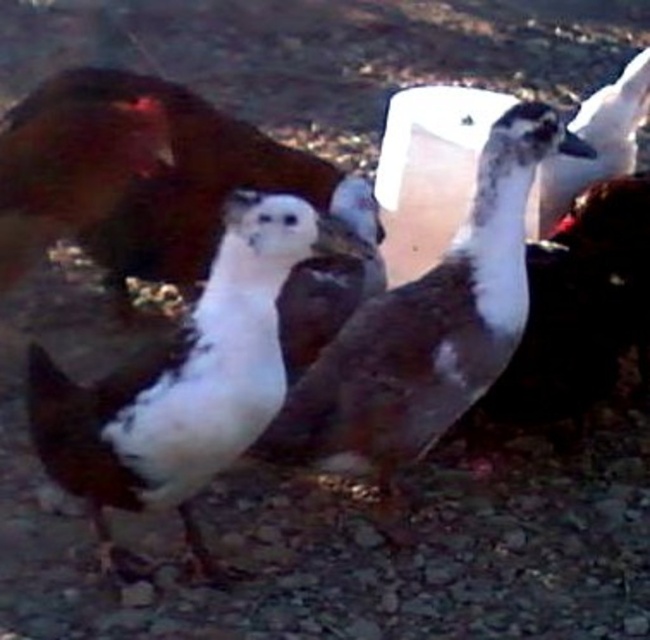
Question: Which point appears closest to the camera in this image?

Choices:
 (A) (83, 432)
 (B) (387, 353)

Answer: (A)

Question: Does white matte duck at center appear under brown matte duck at center?

Choices:
 (A) yes
 (B) no

Answer: (A)

Question: Can you confirm if white matte duck at center is positioned to the left of brown matte duck at center?

Choices:
 (A) no
 (B) yes

Answer: (B)

Question: Among these objects, which one is nearest to the camera?

Choices:
 (A) brown matte duck at center
 (B) white matte duck at center

Answer: (B)

Question: Considering the relative positions of white matte duck at center and brown matte duck at center in the image provided, where is white matte duck at center located with respect to brown matte duck at center?

Choices:
 (A) left
 (B) right

Answer: (A)